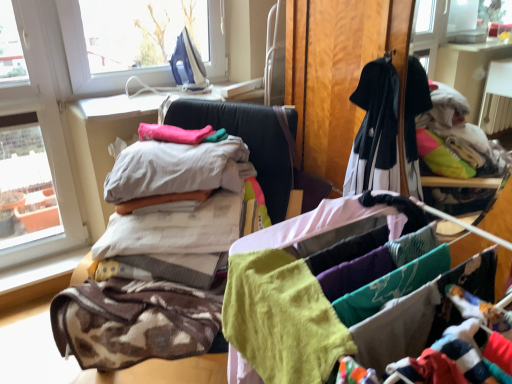
Question: Is there a large distance between white cotton bed at center and brown textured blanket at left, which is counted as the 4th baby clothe, starting from the back?

Choices:
 (A) yes
 (B) no

Answer: (A)

Question: Is white cotton bed at center completely or partially outside of brown textured blanket at left, positioned as the second baby clothe in front-to-back order?

Choices:
 (A) no
 (B) yes

Answer: (B)

Question: Does white cotton bed at center have a lesser height compared to brown textured blanket at left, positioned as the second baby clothe in front-to-back order?

Choices:
 (A) no
 (B) yes

Answer: (A)

Question: Does white cotton bed at center have a larger size compared to brown textured blanket at left, positioned as the second baby clothe in front-to-back order?

Choices:
 (A) yes
 (B) no

Answer: (A)

Question: Is brown textured blanket at left, which is counted as the 4th baby clothe, starting from the back, completely or partially inside white cotton bed at center?

Choices:
 (A) no
 (B) yes

Answer: (B)

Question: Considering the positions of pink fabric at center, the 1th baby clothe in the back-to-front sequence, and soft cotton clothes at center, the second baby clothe viewed from the back, in the image, is pink fabric at center, the 1th baby clothe in the back-to-front sequence, taller or shorter than soft cotton clothes at center, the second baby clothe viewed from the back,?

Choices:
 (A) tall
 (B) short

Answer: (B)

Question: Does point (180, 139) appear closer or farther from the camera than point (138, 140)?

Choices:
 (A) closer
 (B) farther

Answer: (A)

Question: In the image, is pink fabric at center, the 1th baby clothe in the back-to-front sequence, positioned in front of or behind soft cotton clothes at center, the fourth baby clothe viewed from the front?

Choices:
 (A) behind
 (B) front

Answer: (A)

Question: From a real-world perspective, is pink fabric at center, which ranks as the fifth baby clothe in front-to-back order, above or below soft cotton clothes at center, the fourth baby clothe viewed from the front?

Choices:
 (A) above
 (B) below

Answer: (A)

Question: In terms of size, does white cotton bed at center appear bigger or smaller than soft cotton towel at center?

Choices:
 (A) big
 (B) small

Answer: (A)

Question: In terms of width, does white cotton bed at center look wider or thinner when compared to soft cotton towel at center?

Choices:
 (A) thin
 (B) wide

Answer: (B)

Question: From the image's perspective, is white cotton bed at center located above or below soft cotton towel at center?

Choices:
 (A) below
 (B) above

Answer: (B)

Question: Is white cotton bed at center situated inside soft cotton towel at center or outside?

Choices:
 (A) inside
 (B) outside

Answer: (B)

Question: Do you think white cotton sheets at center, which is counted as the 3th baby clothe, starting from the front, is within soft yellow fabric at center, marked as the 5th baby clothe in a back-to-front arrangement, or outside of it?

Choices:
 (A) outside
 (B) inside

Answer: (A)

Question: In terms of size, does white cotton sheets at center, which appears as the third baby clothe when viewed from the back, appear bigger or smaller than soft yellow fabric at center, marked as the 5th baby clothe in a back-to-front arrangement?

Choices:
 (A) big
 (B) small

Answer: (A)